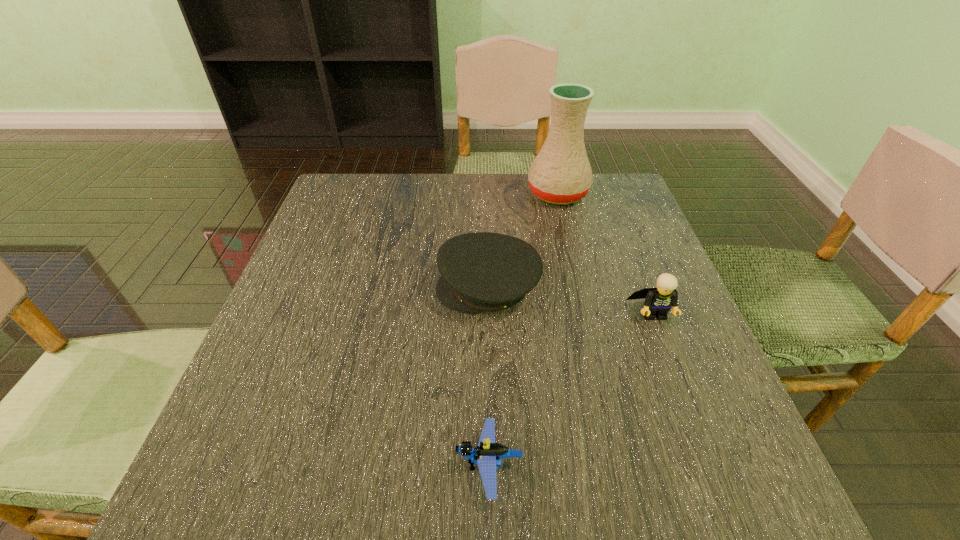
The width and height of the screenshot is (960, 540). What are the coordinates of `free space at the far edge` in the screenshot? It's located at (504, 204).

Identify the location of blank area at the near edge. The width and height of the screenshot is (960, 540). coord(619,505).

Identify the location of free region at the left edge of the desktop. This screenshot has width=960, height=540. (329, 285).

Find the location of `free region at the right edge`. free region at the right edge is located at coordinates (749, 441).

Where is `free region at the far left corner of the desktop`? The width and height of the screenshot is (960, 540). free region at the far left corner of the desktop is located at coordinates (378, 223).

This screenshot has width=960, height=540. In the image, there is a desktop. Find the location of `vacant space at the near right corner`. vacant space at the near right corner is located at coordinates (755, 472).

Where is `free space that is in between the beret and the farther Lego`? The height and width of the screenshot is (540, 960). free space that is in between the beret and the farther Lego is located at coordinates (571, 301).

Image resolution: width=960 pixels, height=540 pixels. What are the coordinates of `free space between the beret and the nearest object` in the screenshot? It's located at (489, 377).

What are the coordinates of `free spot between the farther Lego and the nearest object` in the screenshot? It's located at (571, 390).

In order to click on free space that is in between the beret and the farther Lego in this screenshot , I will do `click(571, 301)`.